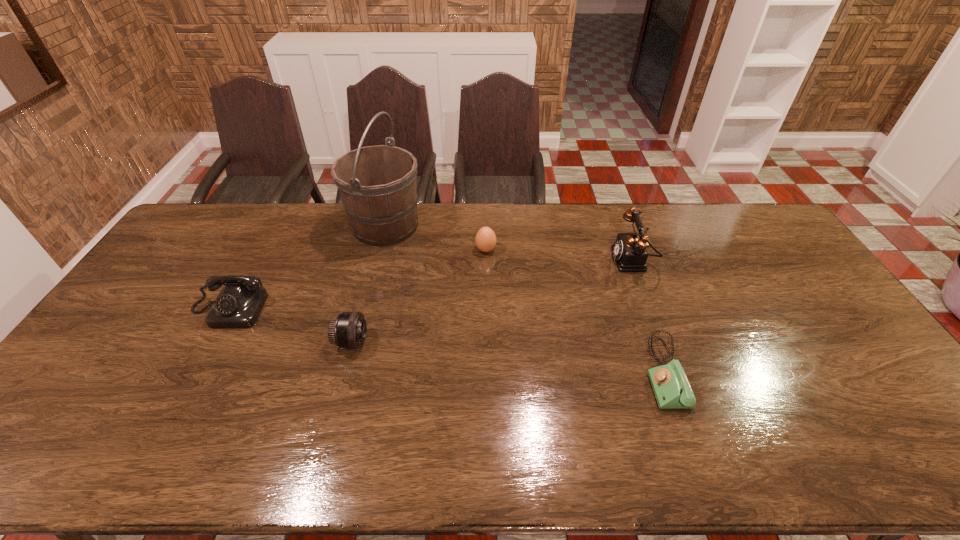
Where is `unoccupied position between the bucket and the nearest telephone`? unoccupied position between the bucket and the nearest telephone is located at coordinates (525, 299).

Where is `vacant space that is in between the nearest telephone and the bucket`? vacant space that is in between the nearest telephone and the bucket is located at coordinates 525,299.

At what (x,y) coordinates should I click in order to perform the action: click on vacant space that is in between the telephoto lens and the leftmost telephone. Please return your answer as a coordinate pair (x, y). Looking at the image, I should click on (290, 326).

What are the coordinates of `unoccupied area between the second nearest telephone and the telephoto lens` in the screenshot? It's located at (290, 326).

Identify the location of vacant point located between the telephoto lens and the farthest telephone. (492, 301).

The width and height of the screenshot is (960, 540). What are the coordinates of `vacant area that lies between the third object from right to left and the leftmost object` in the screenshot? It's located at (357, 280).

This screenshot has width=960, height=540. Identify the location of vacant space that's between the tallest object and the telephoto lens. (369, 284).

Point out which object is positioned as the fifth nearest to the second shortest telephone. Please provide its 2D coordinates. Your answer should be formatted as a tuple, i.e. [(x, y)], where the tuple contains the x and y coordinates of a point satisfying the conditions above.

[(629, 250)]

Identify which object is the fourth nearest to the telephoto lens. Please provide its 2D coordinates. Your answer should be formatted as a tuple, i.e. [(x, y)], where the tuple contains the x and y coordinates of a point satisfying the conditions above.

[(672, 390)]

Identify the location of the third closest telephone to the bucket. The width and height of the screenshot is (960, 540). (672, 390).